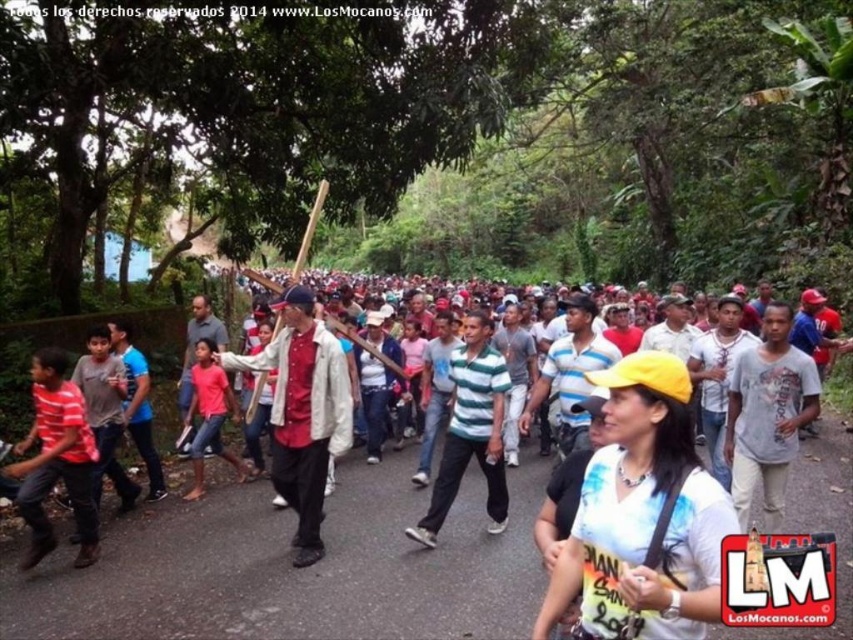
You are standing at the point with coordinates (44, 422) and want to move to the point with coordinates (289, 403). Based on the scene, will you be moving towards the background or the foreground?

Point (289, 403) is behind point (44, 422), so moving to it would mean moving towards the background.